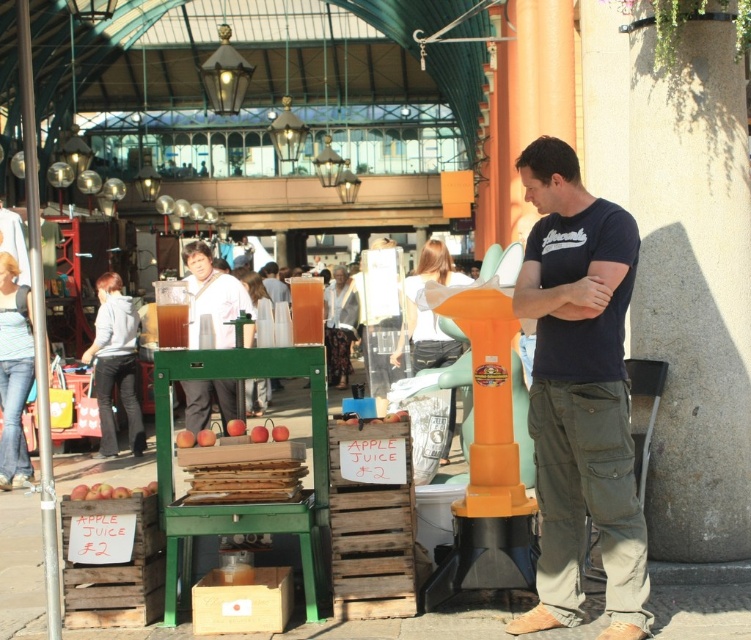
Based on the photo, what is located at the point with coordinates (581,394)?

→ The dark blue t shirt at center is located at the point with coordinates (581,394).

You are standing at the juice stand and want to know how far the point at coordinates (632,234) is from you. Can you determine the distance?

The point at coordinates (632,234) is 6.61 meters away from you.